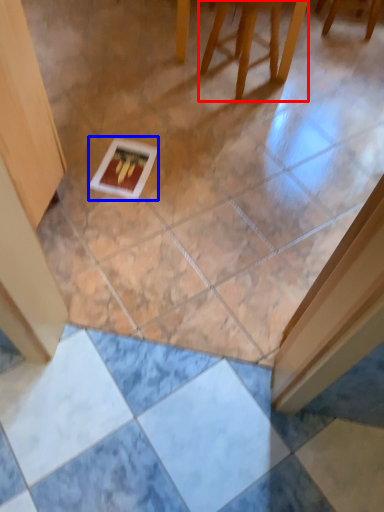
Question: Which point is further to the camera, furniture (highlighted by a red box) or postcard (highlighted by a blue box)?

Choices:
 (A) furniture
 (B) postcard

Answer: (B)